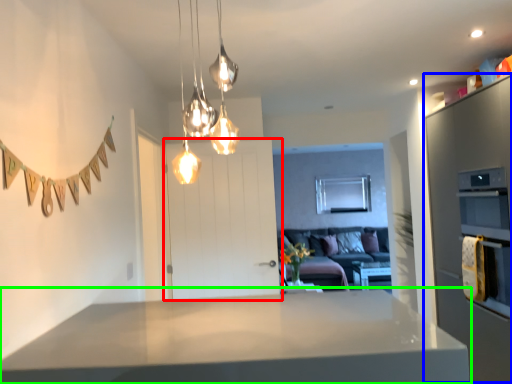
Question: Which is nearer to the door (highlighted by a red box)? cabinetry (highlighted by a blue box) or countertop (highlighted by a green box).

Choices:
 (A) cabinetry
 (B) countertop

Answer: (A)